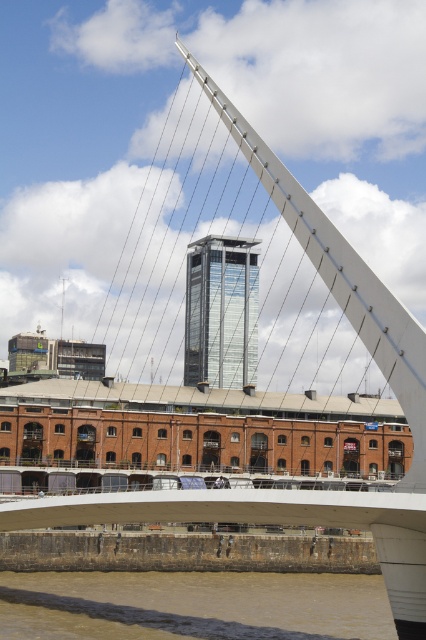
You are standing on the bridge and looking down at the water below. There is a point marked at coordinates point (192, 605). What is the color and type of the water at that point?

The point (192, 605) marks brown muddy water at lower center.

You are an urban planner assessing the city layout. You notice the brown muddy water at lower center and the glassy metallic skyscraper at center. Which of these two features occupies a larger area in the scene?

The glassy metallic skyscraper at center occupies a larger area in the scene compared to the brown muddy water at lower center.

You are a drone operator tasked with capturing aerial footage of the modern urban landscape. Your drone is currently positioned at the camera location. The brown muddy water at lower center is part of a river that needs to be filmed. Considering the drone must stay above 50 meters to avoid disturbing wildlife, can you safely capture the required footage without violating this height restriction?

The brown muddy water at lower center is 50.97 meters from the camera. Since the drone must stay above 50 meters to avoid disturbing wildlife, the current distance of 50.97 meters meets the requirement. Therefore, you can safely capture the required footage without violating the height restriction.